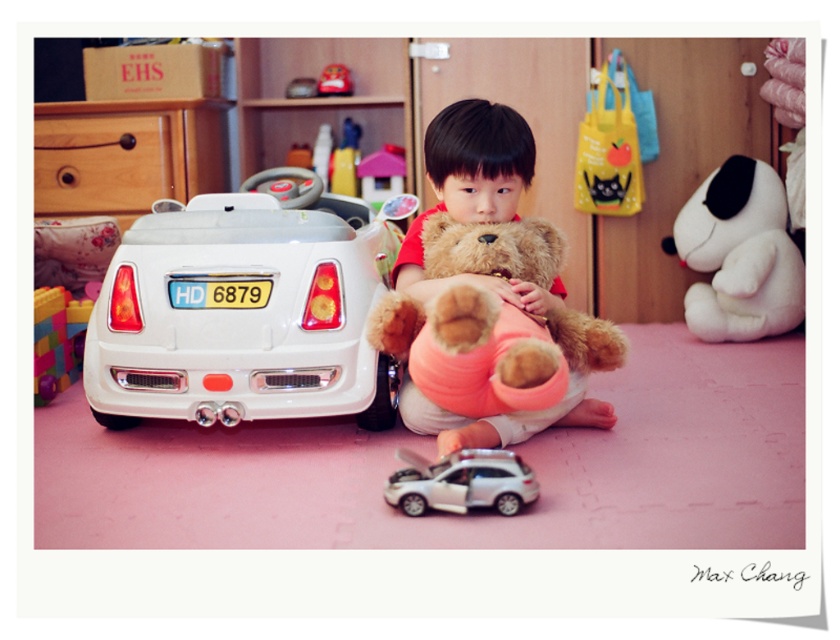
Question: Among these objects, which one is farthest from the camera?

Choices:
 (A) matte plastic toy car at center
 (B) white plush dog at upper right
 (C) silver metallic toy car at center

Answer: (A)

Question: Does white matte toy car at left come in front of white plush dog at upper right?

Choices:
 (A) yes
 (B) no

Answer: (A)

Question: Which is farther from the brown plush teddy bear at center?

Choices:
 (A) white plush dog at upper right
 (B) white matte toy car at left
 (C) silver metallic toy car at center

Answer: (A)

Question: Where is silver metallic toy car at center located in relation to matte plastic toy car at center in the image?

Choices:
 (A) left
 (B) right

Answer: (B)

Question: Which object is positioned farthest from the matte plastic toy car at center?

Choices:
 (A) yellow plastic license plate at center
 (B) multicolored plastic blocks at left
 (C) white plush dog at upper right

Answer: (C)

Question: Can you confirm if brown plush teddy bear at center is positioned below matte plastic toy car at center?

Choices:
 (A) yes
 (B) no

Answer: (A)